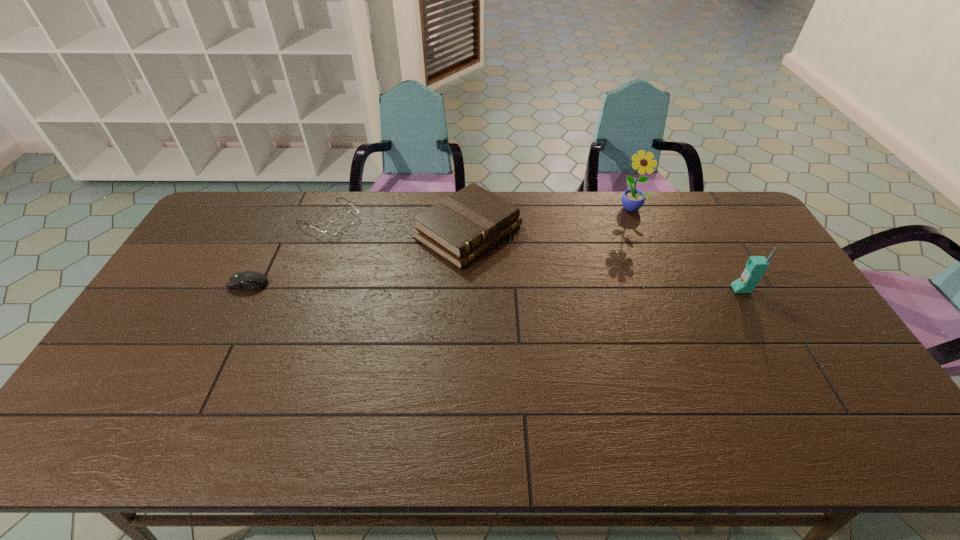
At what (x,y) coordinates should I click in order to perform the action: click on free space located 0.190m through the lenses of the spectacles. Please return your answer as a coordinate pair (x, y). Image resolution: width=960 pixels, height=540 pixels. Looking at the image, I should click on click(x=385, y=256).

Identify the location of vacant space situated 0.120m through the lenses of the spectacles. (372, 247).

The image size is (960, 540). Find the location of `free space located through the lenses of the spectacles`. free space located through the lenses of the spectacles is located at coordinates (375, 249).

The height and width of the screenshot is (540, 960). In order to click on sunflower positioned at the far edge in this screenshot , I will do pyautogui.click(x=632, y=199).

At what (x,y) coordinates should I click in order to perform the action: click on Bible present at the far edge. Please return your answer as a coordinate pair (x, y). This screenshot has width=960, height=540. Looking at the image, I should click on (459, 228).

I want to click on spectacles situated at the far edge, so click(x=333, y=227).

You are a GUI agent. You are given a task and a screenshot of the screen. Output one action in this format:
    pyautogui.click(x=<x>, y=<y>)
    Task: Click on the object that is positioned at the right edge
    
    Given the screenshot: What is the action you would take?
    pyautogui.click(x=756, y=266)

The width and height of the screenshot is (960, 540). In order to click on free space at the far edge in this screenshot , I will do `click(270, 204)`.

Find the location of a particular element. vacant space at the near edge of the desktop is located at coordinates (546, 379).

In the image, there is a desktop. Identify the location of free space at the left edge. (198, 307).